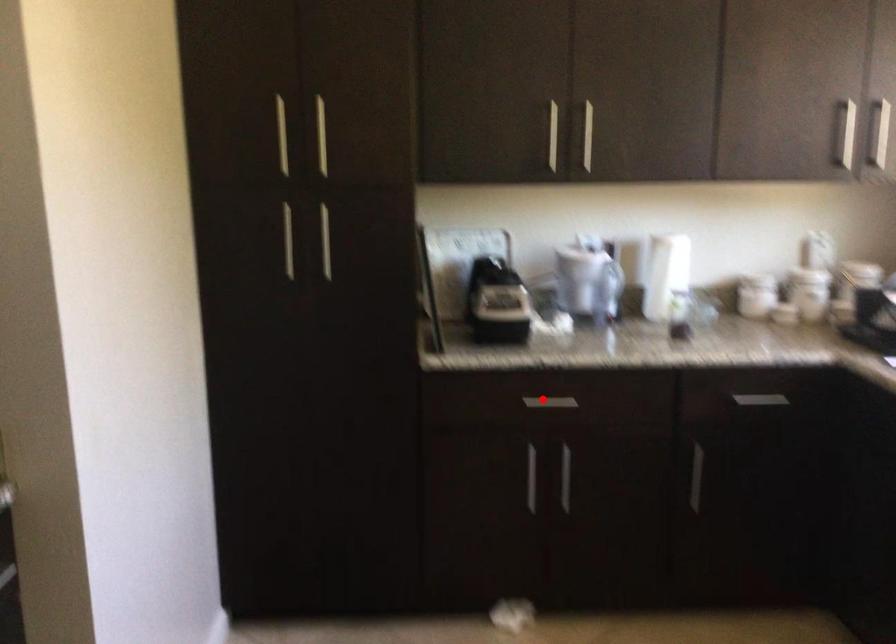
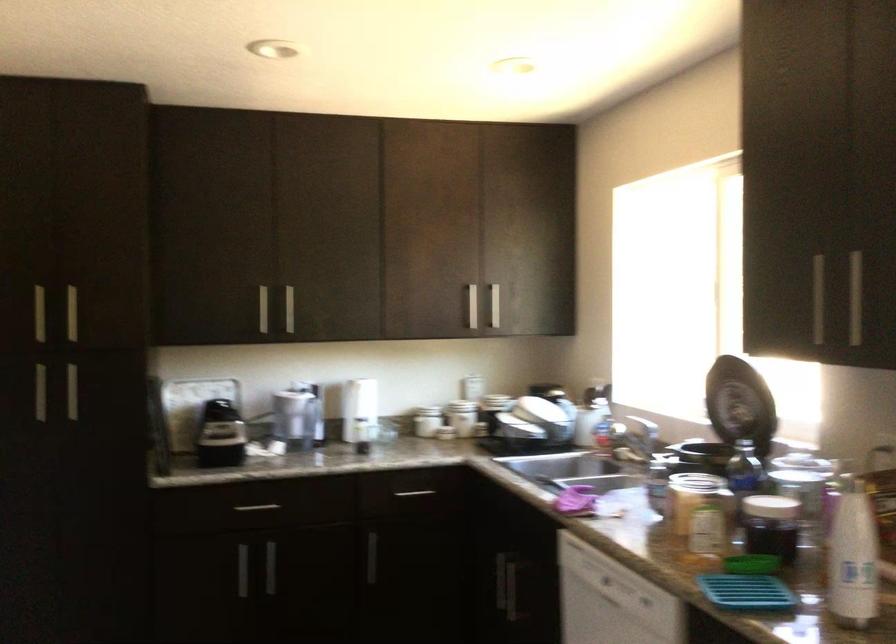
Find the pixel in the second image that matches the highlighted location in the first image.

(256, 507)